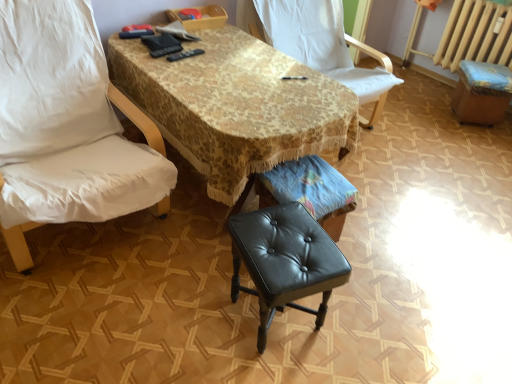
Locate an element on the screen. free space between black leather stool at center and black leather bar stool at lower right is located at coordinates (412, 186).